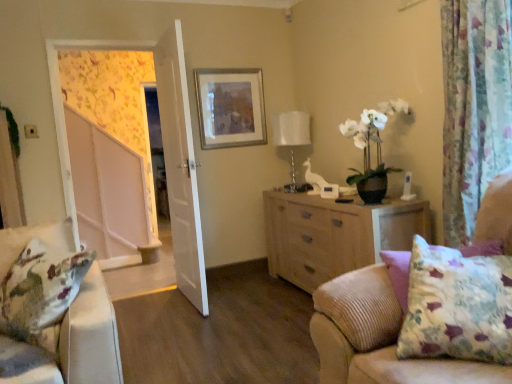
Where is `vacant space situated above silver metallic picture frame at upper center (from a real-world perspective)`? This screenshot has height=384, width=512. vacant space situated above silver metallic picture frame at upper center (from a real-world perspective) is located at coordinates (229, 62).